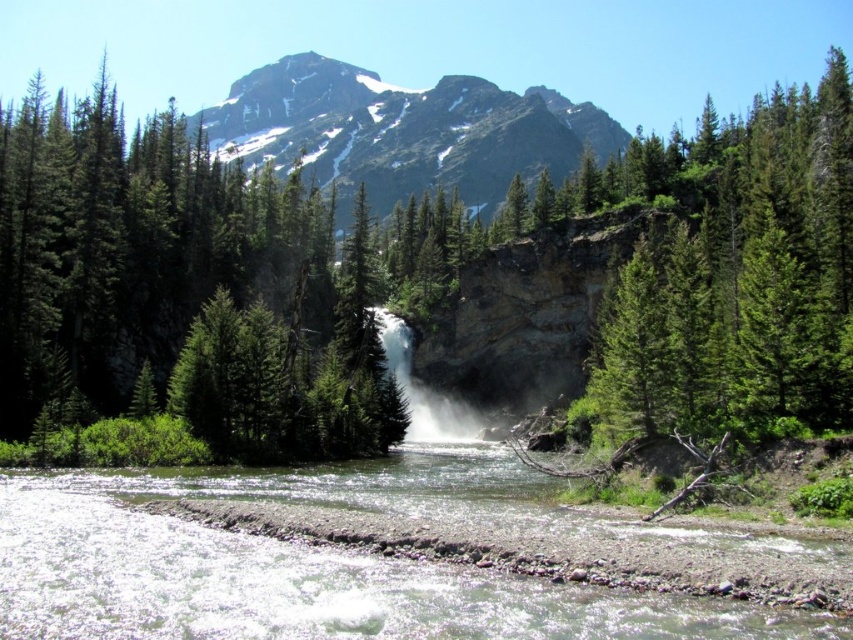
You are a hiker standing at the base of the snowy granite mountain at upper center. You see the clear water at center flowing below. Which object is closer to you?

The clear water at center is closer to you because it is in front of the snowy granite mountain at upper center.